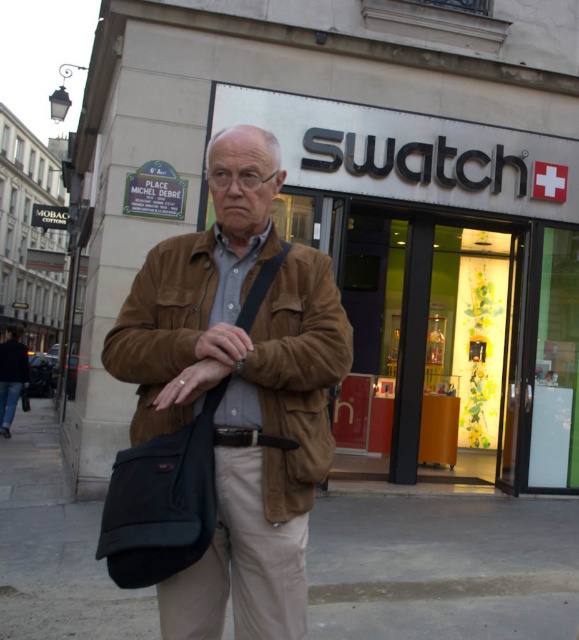
Question: Which point is closer to the camera?

Choices:
 (A) brown suede jacket at center
 (B) khaki cotton pants at center

Answer: (A)

Question: Can you confirm if brown suede jacket at center is smaller than khaki cotton pants at center?

Choices:
 (A) yes
 (B) no

Answer: (B)

Question: Which of the following is the closest to the observer?

Choices:
 (A) (494, 628)
 (B) (463, 289)
 (C) (184, 625)
 (D) (305, 516)

Answer: (C)

Question: In this image, where is matte brown leather store at center located relative to brown fabric bag at center?

Choices:
 (A) below
 (B) above

Answer: (B)

Question: Is brown suede jacket at center in front of brown fabric bag at center?

Choices:
 (A) no
 (B) yes

Answer: (B)

Question: Considering the real-world distances, which object is farthest from the khaki cotton pants at center?

Choices:
 (A) brown suede jacket at center
 (B) matte brown leather store at center

Answer: (B)